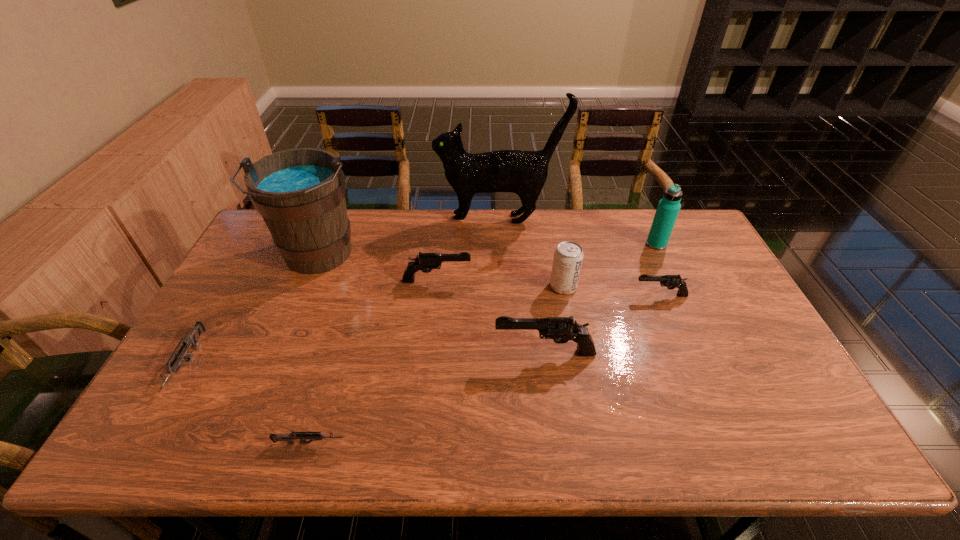
Identify the location of vacant space located 0.190m on the front of the blue water bottle. (678, 289).

I want to click on vacant space situated on the left of the soda can, so pos(527,286).

The image size is (960, 540). I want to click on vacant position located 0.140m at the end of the barrel of the tallest gun, so click(x=443, y=353).

I want to click on vacant area situated 0.060m at the end of the barrel of the tallest gun, so click(x=472, y=353).

Image resolution: width=960 pixels, height=540 pixels. I want to click on blank space located 0.370m at the end of the barrel of the tallest gun, so (x=356, y=353).

At what (x,y) coordinates should I click in order to perform the action: click on vacant space located 0.300m at the end of the barrel of the farthest gun. Please return your answer as a coordinate pair (x, y). The image size is (960, 540). Looking at the image, I should click on (566, 281).

I want to click on vacant space located 0.050m at the end of the barrel of the fourth nearest gun, so click(617, 295).

The height and width of the screenshot is (540, 960). Identify the location of free space located at the end of the barrel of the fourth nearest gun. (585, 295).

Where is `vacant area situated 0.160m at the end of the barrel of the fourth nearest gun`? Image resolution: width=960 pixels, height=540 pixels. vacant area situated 0.160m at the end of the barrel of the fourth nearest gun is located at coordinates [x=581, y=295].

The height and width of the screenshot is (540, 960). I want to click on free space located aimed along the barrel of the leftmost object, so click(141, 443).